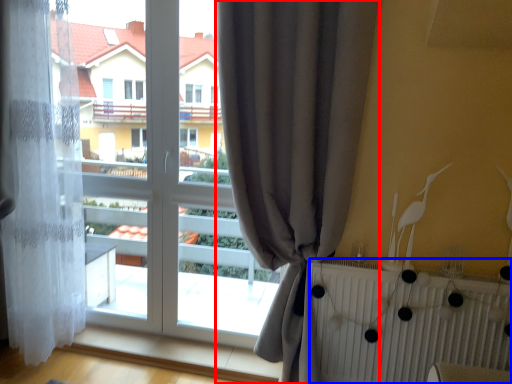
Question: Which object appears closest to the camera in this image, curtain (highlighted by a red box) or radiator (highlighted by a blue box)?

Choices:
 (A) curtain
 (B) radiator

Answer: (A)